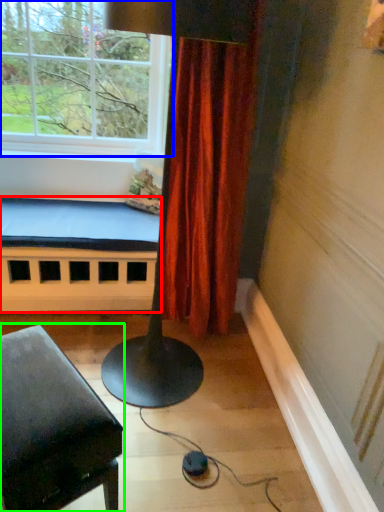
Question: Which is nearer to the bed frame (highlighted by a red box)? window (highlighted by a blue box) or furniture (highlighted by a green box).

Choices:
 (A) window
 (B) furniture

Answer: (A)